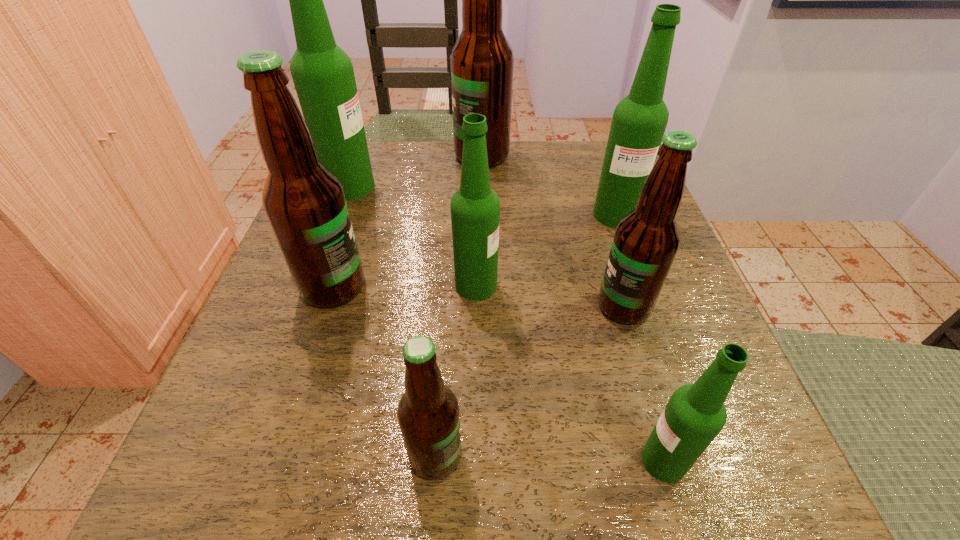
Identify the location of blank space located on the label of the rightmost brown beer bottle. (481, 306).

This screenshot has height=540, width=960. What are the coordinates of `vacant space located 0.090m on the label of the third green beer bottle from right to left` in the screenshot? It's located at (550, 285).

At what (x,y) coordinates should I click in order to perform the action: click on vacant area located 0.190m on the label of the smallest brown beer bottle. Please return your answer as a coordinate pair (x, y). Image resolution: width=960 pixels, height=540 pixels. Looking at the image, I should click on (615, 456).

Image resolution: width=960 pixels, height=540 pixels. Identify the location of vacant area situated on the label of the smallest green beer bottle. (495, 461).

Where is `vacant space located on the label of the smallest green beer bottle`? This screenshot has width=960, height=540. vacant space located on the label of the smallest green beer bottle is located at coordinates (366, 461).

Image resolution: width=960 pixels, height=540 pixels. Find the location of `vacant space located on the label of the smallest green beer bottle`. vacant space located on the label of the smallest green beer bottle is located at coordinates (577, 461).

Identify the location of object that is positioned at the far left corner. This screenshot has height=540, width=960. (323, 75).

The width and height of the screenshot is (960, 540). I want to click on object located in the near right corner section of the desktop, so click(695, 414).

In the image, there is a desktop. What are the coordinates of `free region at the far edge` in the screenshot? It's located at (523, 161).

Image resolution: width=960 pixels, height=540 pixels. In order to click on vacant space at the near edge of the desktop in this screenshot , I will do `click(511, 465)`.